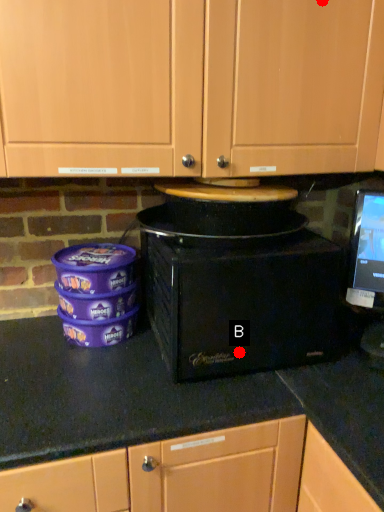
Question: Two points are circled on the image, labeled by A and B beside each circle. Which point is further to the camera?

Choices:
 (A) A is further
 (B) B is further

Answer: (B)